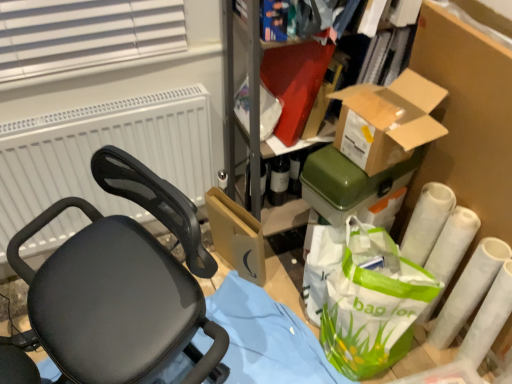
Question: Could you tell me if brown cardboard box at upper right, marked as the second box in a back-to-front arrangement, is turned towards white matte toilet paper at lower right, which is the first toilet paper in left-to-right order?

Choices:
 (A) yes
 (B) no

Answer: (B)

Question: From a real-world perspective, is brown cardboard box at upper right, acting as the 1th box starting from the front, below white matte toilet paper at lower right, which is the first toilet paper in left-to-right order?

Choices:
 (A) no
 (B) yes

Answer: (A)

Question: Is brown cardboard box at upper right, marked as the second box in a back-to-front arrangement, next to white matte toilet paper at lower right, which is the first toilet paper in left-to-right order, and touching it?

Choices:
 (A) no
 (B) yes

Answer: (A)

Question: Considering the relative sizes of brown cardboard box at upper right, acting as the 1th box starting from the front, and white matte toilet paper at lower right, acting as the 2th toilet paper starting from the right, in the image provided, is brown cardboard box at upper right, acting as the 1th box starting from the front, thinner than white matte toilet paper at lower right, acting as the 2th toilet paper starting from the right,?

Choices:
 (A) no
 (B) yes

Answer: (A)

Question: Considering the relative sizes of brown cardboard box at upper right, marked as the second box in a back-to-front arrangement, and white matte toilet paper at lower right, which is the first toilet paper in left-to-right order, in the image provided, is brown cardboard box at upper right, marked as the second box in a back-to-front arrangement, shorter than white matte toilet paper at lower right, which is the first toilet paper in left-to-right order,?

Choices:
 (A) no
 (B) yes

Answer: (B)

Question: Can you confirm if brown cardboard box at upper right, acting as the 1th box starting from the front, is taller than white matte toilet paper at lower right, acting as the 2th toilet paper starting from the right?

Choices:
 (A) yes
 (B) no

Answer: (B)

Question: Does white matte toilet paper at lower right, the 1th toilet paper when ordered from right to left, appear on the right side of black mesh chair at left?

Choices:
 (A) yes
 (B) no

Answer: (A)

Question: Can black mesh chair at left be found inside white matte toilet paper at lower right, the 1th toilet paper when ordered from right to left?

Choices:
 (A) no
 (B) yes

Answer: (A)

Question: Does white matte toilet paper at lower right, the 1th toilet paper when ordered from right to left, turn towards black mesh chair at left?

Choices:
 (A) no
 (B) yes

Answer: (A)

Question: Can you confirm if white matte toilet paper at lower right, the 1th toilet paper when ordered from right to left, is smaller than black mesh chair at left?

Choices:
 (A) no
 (B) yes

Answer: (B)

Question: Is white matte toilet paper at lower right, the 1th toilet paper when ordered from right to left, next to black mesh chair at left and touching it?

Choices:
 (A) yes
 (B) no

Answer: (B)

Question: Does white matte toilet paper at lower right, acting as the 2th toilet paper starting from the left, have a larger size compared to black mesh chair at left?

Choices:
 (A) no
 (B) yes

Answer: (A)

Question: Is black mesh chair at left at the left side of green plastic container at upper right, which is the 1th box from back to front?

Choices:
 (A) no
 (B) yes

Answer: (B)